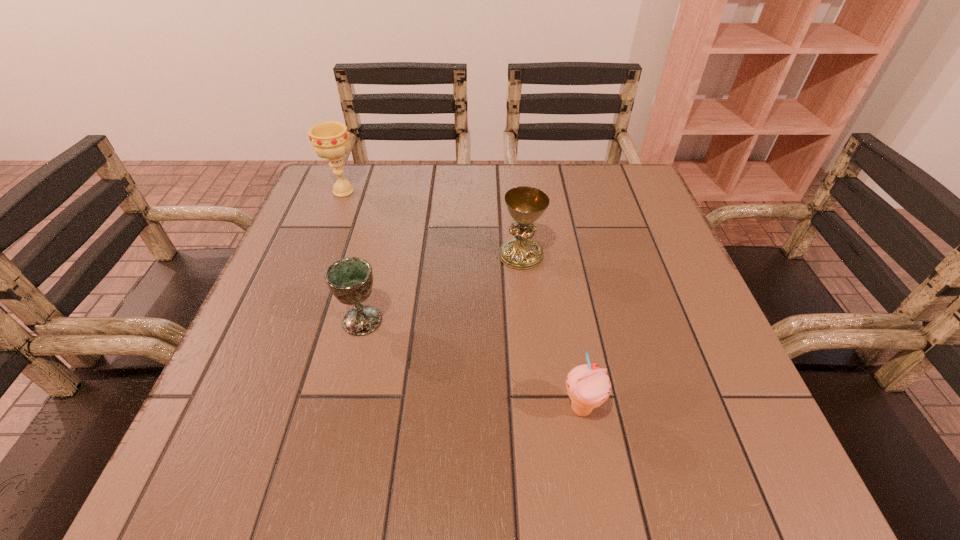
What are the coordinates of `free space between the farthest chalice and the rightmost chalice` in the screenshot? It's located at (432, 223).

Image resolution: width=960 pixels, height=540 pixels. Identify the location of free space between the second farthest object and the nearest object. (551, 332).

Where is `object that is the closest to the second object from left to right`? object that is the closest to the second object from left to right is located at coordinates (526, 205).

Image resolution: width=960 pixels, height=540 pixels. What are the coordinates of `object that is the third closest to the second farthest chalice` in the screenshot? It's located at [330, 140].

Locate an element on the screen. The height and width of the screenshot is (540, 960). chalice identified as the second closest to the shortest chalice is located at coordinates (330, 140).

Point out which chalice is positioned as the second nearest to the rightmost chalice. Please provide its 2D coordinates. Your answer should be formatted as a tuple, i.e. [(x, y)], where the tuple contains the x and y coordinates of a point satisfying the conditions above.

[(330, 140)]

Image resolution: width=960 pixels, height=540 pixels. In order to click on free space that satisfies the following two spatial constraints: 1. on the front side of the nearest object; 2. on the left side of the second chalice from left to right in this screenshot , I will do `click(341, 409)`.

Identify the location of vacant region that satisfies the following two spatial constraints: 1. on the front side of the second chalice from right to left; 2. on the left side of the icecream. This screenshot has width=960, height=540. (341, 409).

In order to click on vacant area in the image that satisfies the following two spatial constraints: 1. on the front side of the nearest object; 2. on the left side of the third object from right to left in this screenshot , I will do `click(341, 409)`.